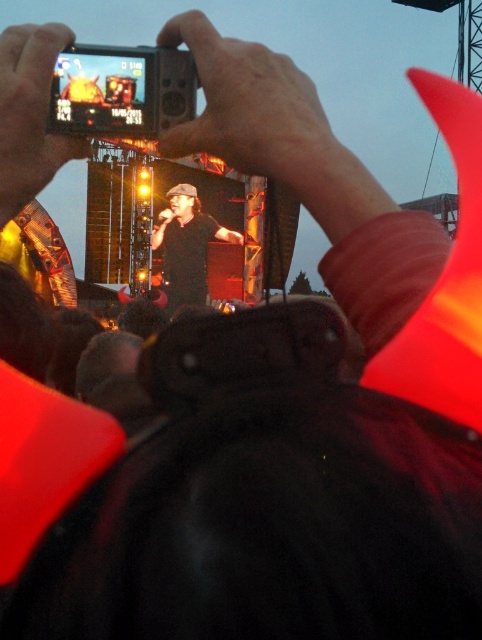
Who is positioned more to the right, black plastic camera at upper center or black matte shirt at center?

black plastic camera at upper center is more to the right.

In the scene shown: Between black plastic camera at upper center and black matte shirt at center, which one has more height?

black matte shirt at center

At what (x,y) coordinates should I click in order to perform the action: click on black plastic camera at upper center. Please return your answer as a coordinate pair (x, y). Looking at the image, I should click on (251, 108).

Where is `black plastic camera at upper center`? Image resolution: width=482 pixels, height=640 pixels. black plastic camera at upper center is located at coordinates click(x=251, y=108).

I want to click on black plastic camera at upper center, so click(251, 108).

Is black plastic camera at upper center below matte black phone at upper left?

No.

Is point (254, 74) closer to camera compared to point (30, 132)?

Yes, it is in front of point (30, 132).

At what (x,y) coordinates should I click in order to perform the action: click on black plastic camera at upper center. Please return your answer as a coordinate pair (x, y). This screenshot has width=482, height=640. Looking at the image, I should click on (251, 108).

Which is more to the right, matte black phone at upper left or black matte shirt at center?

From the viewer's perspective, black matte shirt at center appears more on the right side.

Is matte black phone at upper left bigger than black matte shirt at center?

Yes, matte black phone at upper left is bigger than black matte shirt at center.

Does point (58, 164) come in front of point (174, 308)?

Yes, point (58, 164) is in front of point (174, 308).

Locate an element on the screen. matte black phone at upper left is located at coordinates (29, 115).